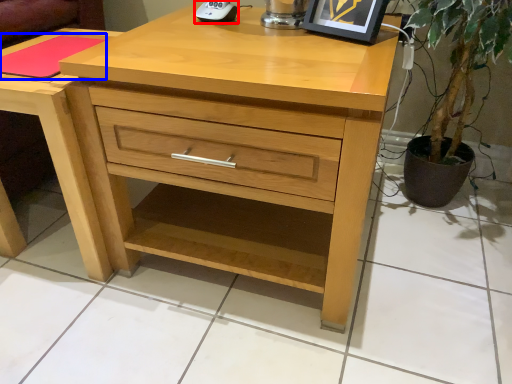
Question: Which of the following is the closest to the observer, gadget (highlighted by a red box) or pad (highlighted by a blue box)?

Choices:
 (A) gadget
 (B) pad

Answer: (B)